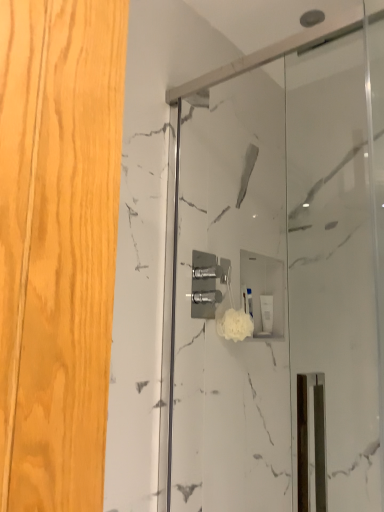
The height and width of the screenshot is (512, 384). In order to click on white marble shower door at center in this screenshot , I will do `click(281, 277)`.

Describe the element at coordinates (281, 277) in the screenshot. I see `white marble shower door at center` at that location.

Find the location of a particular element. white matte soap dispenser at center is located at coordinates (267, 313).

This screenshot has height=512, width=384. I want to click on flower below the white marble shower door at center (from a real-world perspective), so pyautogui.click(x=235, y=325).

Considering the sizes of objects white fluffy sponge at center and white marble shower door at center in the image provided, who is bigger, white fluffy sponge at center or white marble shower door at center?

With larger size is white marble shower door at center.

From the image's perspective, is white fluffy sponge at center under white marble shower door at center?

Yes, from the image's perspective, white fluffy sponge at center is beneath white marble shower door at center.

Is white fluffy sponge at center situated inside white marble shower door at center or outside?

white fluffy sponge at center is not enclosed by white marble shower door at center.

Is white matte soap dispenser at center at the back of white fluffy sponge at center?

No, white matte soap dispenser at center is not at the back of white fluffy sponge at center.

Looking at this image, looking at their sizes, would you say white fluffy sponge at center is wider or thinner than white matte soap dispenser at center?

white fluffy sponge at center is wider than white matte soap dispenser at center.

Does white fluffy sponge at center appear on the right side of white matte soap dispenser at center?

In fact, white fluffy sponge at center is to the left of white matte soap dispenser at center.

Would you say white matte soap dispenser at center is outside white marble shower door at center?

white matte soap dispenser at center is positioned outside white marble shower door at center.

How much distance is there between white matte soap dispenser at center and white marble shower door at center?

white matte soap dispenser at center is 23.01 inches from white marble shower door at center.

Is white matte soap dispenser at center thinner than white marble shower door at center?

Incorrect, the width of white matte soap dispenser at center is not less than that of white marble shower door at center.

Does point (264, 308) lie behind point (218, 234)?

Yes.

Does white marble shower door at center have a greater width compared to white matte soap dispenser at center?

In fact, white marble shower door at center might be narrower than white matte soap dispenser at center.

Is white marble shower door at center with white matte soap dispenser at center?

No, white marble shower door at center is not beside white matte soap dispenser at center.

Is white marble shower door at center turned away from white matte soap dispenser at center?

Correct, white marble shower door at center is looking away from white matte soap dispenser at center.

Considering the relative sizes of white marble shower door at center and white matte soap dispenser at center in the image provided, is white marble shower door at center smaller than white matte soap dispenser at center?

Actually, white marble shower door at center might be larger than white matte soap dispenser at center.

From a real-world perspective, who is located lower, white marble shower door at center or white fluffy sponge at center?

white fluffy sponge at center, from a real-world perspective.

Is white marble shower door at center inside the boundaries of white fluffy sponge at center, or outside?

white marble shower door at center is not inside white fluffy sponge at center, it's outside.

Is white marble shower door at center wider or thinner than white fluffy sponge at center?

Clearly, white marble shower door at center has less width compared to white fluffy sponge at center.

Which of these two, white marble shower door at center or white fluffy sponge at center, stands taller?

Standing taller between the two is white marble shower door at center.

From the image's perspective, between white matte soap dispenser at center and white fluffy sponge at center, who is located below?

white matte soap dispenser at center is shown below in the image.

How much distance is there between white matte soap dispenser at center and white fluffy sponge at center?

A distance of 13.20 inches exists between white matte soap dispenser at center and white fluffy sponge at center.

Is white matte soap dispenser at center to the left or to the right of white fluffy sponge at center in the image?

Based on their positions, white matte soap dispenser at center is located to the right of white fluffy sponge at center.

Find the location of `flower below the white marble shower door at center (from the image's perspective)`. flower below the white marble shower door at center (from the image's perspective) is located at coordinates (235, 325).

The width and height of the screenshot is (384, 512). I want to click on flower below the white matte soap dispenser at center (from a real-world perspective), so click(x=235, y=325).

When comparing their distances from white marble shower door at center, does white matte soap dispenser at center or white fluffy sponge at center seem closer?

Among the two, white fluffy sponge at center is located nearer to white marble shower door at center.

Considering their positions, is white fluffy sponge at center positioned closer to white marble shower door at center than white matte soap dispenser at center?

white fluffy sponge at center is positioned closer to the anchor white marble shower door at center.

Estimate the real-world distances between objects in this image. Which object is closer to white fluffy sponge at center, white matte soap dispenser at center or white marble shower door at center?

white matte soap dispenser at center lies closer to white fluffy sponge at center than the other object.

Looking at the image, which one is located closer to white matte soap dispenser at center, white fluffy sponge at center or white marble shower door at center?

white fluffy sponge at center is positioned closer to the anchor white matte soap dispenser at center.

Estimate the real-world distances between objects in this image. Which object is closer to white matte soap dispenser at center, white marble shower door at center or white fluffy sponge at center?

Based on the image, white fluffy sponge at center appears to be nearer to white matte soap dispenser at center.

Looking at the image, which one is located closer to white fluffy sponge at center, white marble shower door at center or white matte soap dispenser at center?

white matte soap dispenser at center lies closer to white fluffy sponge at center than the other object.

Where is `flower located between white marble shower door at center and white matte soap dispenser at center in the depth direction`? The width and height of the screenshot is (384, 512). flower located between white marble shower door at center and white matte soap dispenser at center in the depth direction is located at coordinates (235, 325).